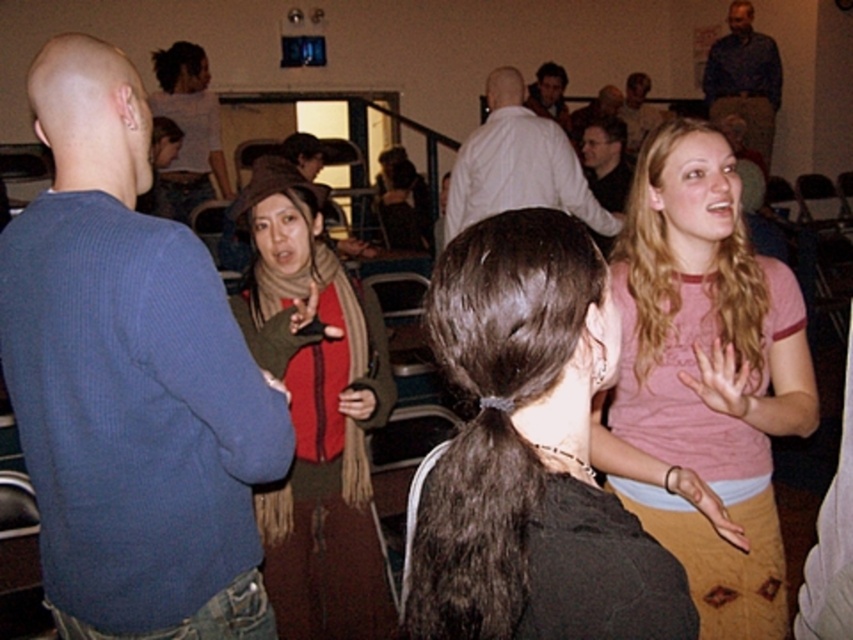
Is the position of pink cotton shirt at upper right more distant than that of matte black jacket at upper center?

That is False.

Locate an element on the screen. The width and height of the screenshot is (853, 640). pink cotton shirt at upper right is located at coordinates (704, 380).

Locate an element on the screen. The width and height of the screenshot is (853, 640). pink cotton shirt at upper right is located at coordinates (704, 380).

The height and width of the screenshot is (640, 853). In order to click on pink cotton shirt at upper right in this screenshot , I will do `click(704, 380)`.

Does blue ribbed sweater at left have a larger size compared to smooth brown shirt at upper center?

Incorrect, blue ribbed sweater at left is not larger than smooth brown shirt at upper center.

Is point (125, 536) less distant than point (648, 118)?

That is True.

Identify the location of blue ribbed sweater at left. (131, 380).

You are a GUI agent. You are given a task and a screenshot of the screen. Output one action in this format:
    pyautogui.click(x=<x>, y=<y>)
    Task: Click on the blue ribbed sweater at left
    This screenshot has width=853, height=640.
    Given the screenshot: What is the action you would take?
    tap(131, 380)

Is point (558, 164) positioned after point (650, 84)?

No, (558, 164) is in front of (650, 84).

Between white shirt at center and smooth brown shirt at upper center, which one appears on the left side from the viewer's perspective?

white shirt at center

Between point (445, 224) and point (616, 112), which one is positioned in front?

Point (445, 224) is more forward.

This screenshot has height=640, width=853. I want to click on white shirt at center, so click(518, 164).